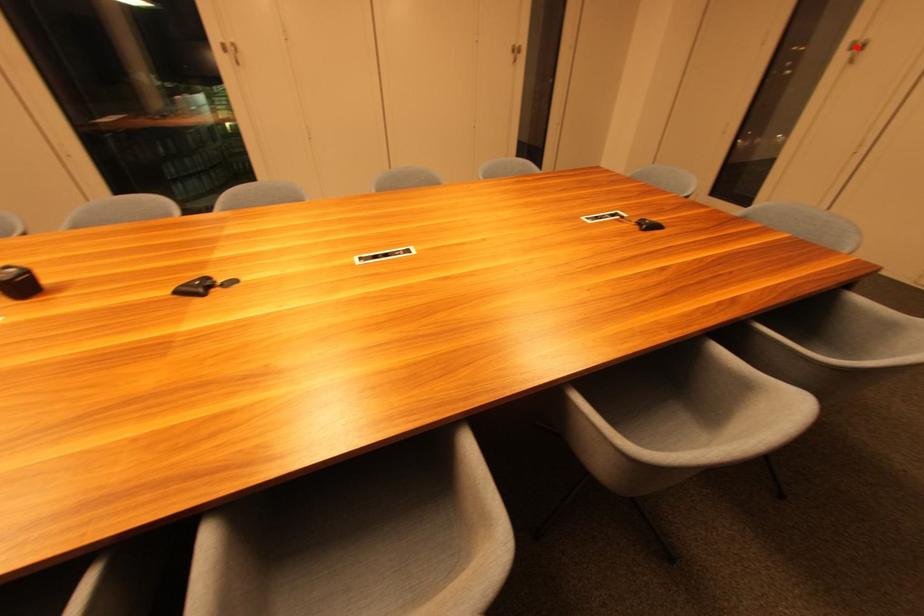
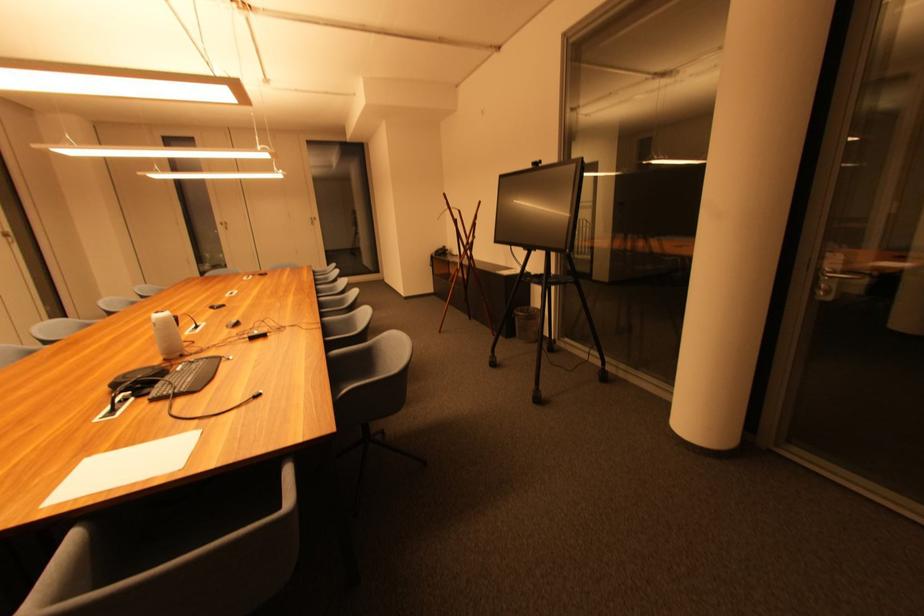
The point at the highlighted location is marked in the first image. Where is the corresponding point in the second image?

(226, 225)